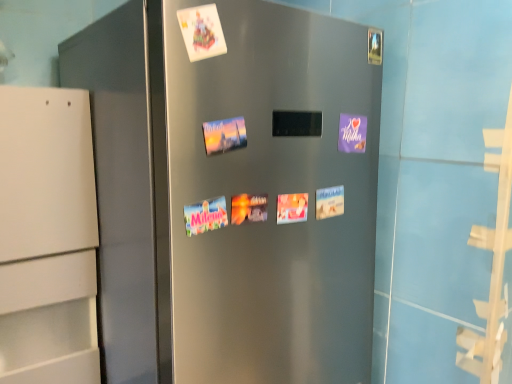
Describe the element at coordinates (329, 202) in the screenshot. The height and width of the screenshot is (384, 512). I see `white paper postcard at center, acting as the 1th postcard starting from the bottom` at that location.

This screenshot has height=384, width=512. What are the coordinates of `purple matte postcard at upper right, the 2th postcard positioned from the bottom` in the screenshot? It's located at (352, 133).

Where is `white paper postcard at center, which is the 2th postcard in top-to-bottom order`? white paper postcard at center, which is the 2th postcard in top-to-bottom order is located at coordinates (329, 202).

Is point (352, 137) behind point (336, 198)?

Yes, it is behind point (336, 198).

Is purple matte postcard at upper right, arranged as the 1th postcard when viewed from the top, taller or shorter than white paper postcard at center, which is the 2th postcard in top-to-bottom order?

In the image, purple matte postcard at upper right, arranged as the 1th postcard when viewed from the top, appears to be taller than white paper postcard at center, which is the 2th postcard in top-to-bottom order.

Is purple matte postcard at upper right, the 2th postcard positioned from the bottom, turned away from white paper postcard at center, acting as the 1th postcard starting from the bottom?

No, purple matte postcard at upper right, the 2th postcard positioned from the bottom, is not facing away from white paper postcard at center, acting as the 1th postcard starting from the bottom.

From a real-world perspective, between purple matte postcard at upper right, the 2th postcard positioned from the bottom, and white paper postcard at center, which is the 2th postcard in top-to-bottom order, who is vertically lower?

From a 3D spatial view, white paper postcard at center, which is the 2th postcard in top-to-bottom order, is below.

Is purple matte postcard at upper right, the 2th postcard positioned from the bottom, closer to camera compared to white paper at upper center?

No.

Can you confirm if purple matte postcard at upper right, the 2th postcard positioned from the bottom, is shorter than white paper at upper center?

No.

From the image's perspective, who appears lower, purple matte postcard at upper right, the 2th postcard positioned from the bottom, or white paper at upper center?

purple matte postcard at upper right, the 2th postcard positioned from the bottom, from the image's perspective.

From a real-world perspective, is white paper at upper center physically above purple matte postcard at upper right, arranged as the 1th postcard when viewed from the top?

Correct, in the physical world, white paper at upper center is higher than purple matte postcard at upper right, arranged as the 1th postcard when viewed from the top.

Between white paper at upper center and purple matte postcard at upper right, arranged as the 1th postcard when viewed from the top, which one appears on the left side from the viewer's perspective?

Positioned to the left is white paper at upper center.

What's the angular difference between white paper at upper center and purple matte postcard at upper right, the 2th postcard positioned from the bottom,'s facing directions?

There is a 5.21-degree angle between the facing directions of white paper at upper center and purple matte postcard at upper right, the 2th postcard positioned from the bottom.

Can we say white paper at upper center lies outside purple matte postcard at upper right, the 2th postcard positioned from the bottom?

Yes, white paper at upper center is outside of purple matte postcard at upper right, the 2th postcard positioned from the bottom.

Could you tell me if white paper postcard at center, acting as the 1th postcard starting from the bottom, is turned towards white paper at upper center?

No, white paper postcard at center, acting as the 1th postcard starting from the bottom, is not aimed at white paper at upper center.

Is white paper postcard at center, which is the 2th postcard in top-to-bottom order, smaller than white paper at upper center?

Indeed, white paper postcard at center, which is the 2th postcard in top-to-bottom order, has a smaller size compared to white paper at upper center.

From a real-world perspective, is white paper postcard at center, which is the 2th postcard in top-to-bottom order, above or below white paper at upper center?

white paper postcard at center, which is the 2th postcard in top-to-bottom order, is below white paper at upper center.

Can you confirm if white paper postcard at center, which is the 2th postcard in top-to-bottom order, is wider than white paper at upper center?

No.

Where is `postcard located in front of the purple matte postcard at upper right, arranged as the 1th postcard when viewed from the top`? postcard located in front of the purple matte postcard at upper right, arranged as the 1th postcard when viewed from the top is located at coordinates (329, 202).

Is purple matte postcard at upper right, the 2th postcard positioned from the bottom, completely or partially inside white paper postcard at center, which is the 2th postcard in top-to-bottom order?

No, purple matte postcard at upper right, the 2th postcard positioned from the bottom, is not a part of white paper postcard at center, which is the 2th postcard in top-to-bottom order.

Does white paper postcard at center, acting as the 1th postcard starting from the bottom, have a lesser width compared to purple matte postcard at upper right, arranged as the 1th postcard when viewed from the top?

Yes.

Does white paper at upper center have a larger size compared to white paper postcard at center, acting as the 1th postcard starting from the bottom?

Indeed, white paper at upper center has a larger size compared to white paper postcard at center, acting as the 1th postcard starting from the bottom.

Considering the sizes of objects white paper at upper center and white paper postcard at center, which is the 2th postcard in top-to-bottom order, in the image provided, who is thinner, white paper at upper center or white paper postcard at center, which is the 2th postcard in top-to-bottom order,?

With smaller width is white paper postcard at center, which is the 2th postcard in top-to-bottom order.

What's the angular difference between white paper at upper center and white paper postcard at center, which is the 2th postcard in top-to-bottom order,'s facing directions?

5.21 degrees separate the facing orientations of white paper at upper center and white paper postcard at center, which is the 2th postcard in top-to-bottom order.

Is white paper at upper center not close to white paper postcard at center, which is the 2th postcard in top-to-bottom order?

No, there isn't a large distance between white paper at upper center and white paper postcard at center, which is the 2th postcard in top-to-bottom order.

I want to click on postcard located in front of the purple matte postcard at upper right, the 2th postcard positioned from the bottom, so click(329, 202).

There is a white paper at upper center. Identify the location of the 1st postcard below it (from a real-world perspective). (352, 133).

Which object lies further to the anchor point purple matte postcard at upper right, arranged as the 1th postcard when viewed from the top, white paper postcard at center, which is the 2th postcard in top-to-bottom order, or white paper at upper center?

Based on the image, white paper at upper center appears to be further to purple matte postcard at upper right, arranged as the 1th postcard when viewed from the top.

Which object lies further to the anchor point white paper postcard at center, acting as the 1th postcard starting from the bottom, white paper at upper center or purple matte postcard at upper right, arranged as the 1th postcard when viewed from the top?

white paper at upper center lies further to white paper postcard at center, acting as the 1th postcard starting from the bottom, than the other object.

Which object lies further to the anchor point white paper at upper center, white paper postcard at center, which is the 2th postcard in top-to-bottom order, or purple matte postcard at upper right, arranged as the 1th postcard when viewed from the top?

white paper postcard at center, which is the 2th postcard in top-to-bottom order.

When comparing their distances from purple matte postcard at upper right, the 2th postcard positioned from the bottom, does white paper at upper center or white paper postcard at center, which is the 2th postcard in top-to-bottom order, seem closer?

Among the two, white paper postcard at center, which is the 2th postcard in top-to-bottom order, is located nearer to purple matte postcard at upper right, the 2th postcard positioned from the bottom.

When comparing their distances from white paper postcard at center, acting as the 1th postcard starting from the bottom, does purple matte postcard at upper right, the 2th postcard positioned from the bottom, or white paper at upper center seem further?

The object further to white paper postcard at center, acting as the 1th postcard starting from the bottom, is white paper at upper center.

When comparing their distances from white paper at upper center, does purple matte postcard at upper right, the 2th postcard positioned from the bottom, or white paper postcard at center, acting as the 1th postcard starting from the bottom, seem closer?

purple matte postcard at upper right, the 2th postcard positioned from the bottom, lies closer to white paper at upper center than the other object.

The height and width of the screenshot is (384, 512). What are the coordinates of `postcard between white paper at upper center and purple matte postcard at upper right, arranged as the 1th postcard when viewed from the top, in the horizontal direction` in the screenshot? It's located at (329, 202).